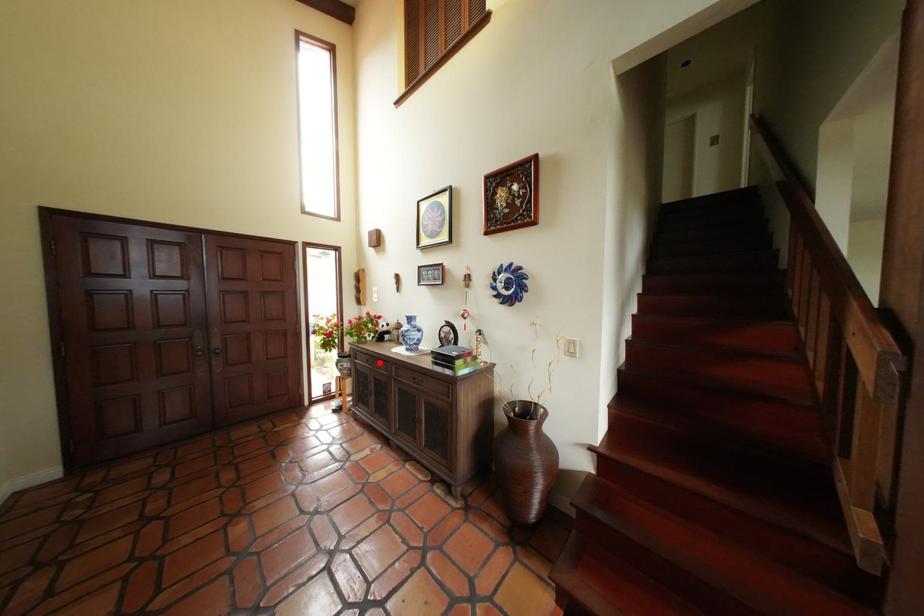
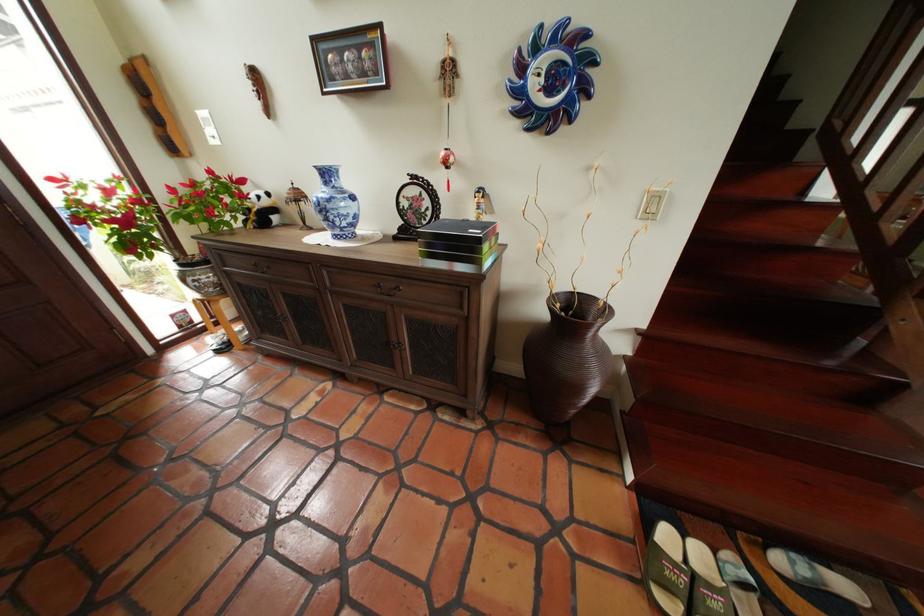
Question: A red point is marked in image1. In image2, is the corresponding 3D point closer to the camera or farther? Reply with the corresponding letter.

Choices:
 (A) The corresponding 3D point is closer.
 (B) The corresponding 3D point is farther.

Answer: (A)